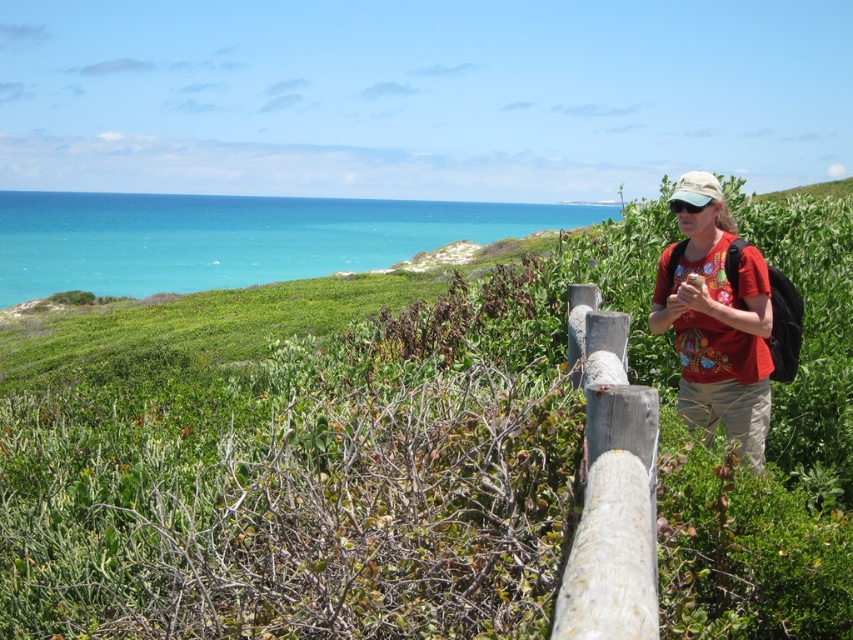
You are standing at the coastal scene and want to determine which of the two points, point (x=363, y=301) or point (x=732, y=333), is closer to you. Based on the image, which point is nearer?

Point (x=363, y=301) is closer to you because it is further to the viewer than point (x=732, y=333).

You are standing at the center of the scene and want to place a small flag exactly at the location of the green leafy grass at center. What are the coordinates where you should place the flag?

The coordinates for the green leafy grass at center are point [409,458], so you should place the flag at those coordinates.